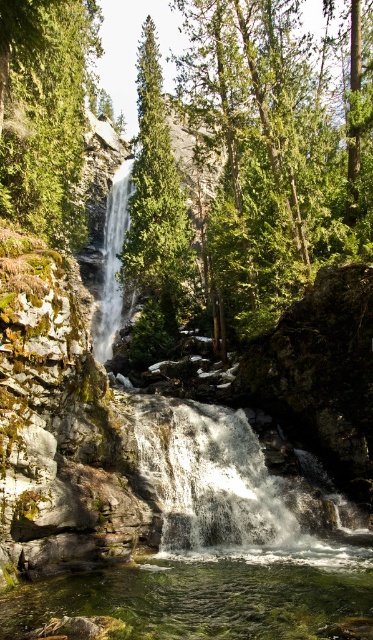
You are a hiker who wants to take a photo of the clear water at center and the green matte tree at upper left from your current position. Can you fit both objects in the frame of your camera which has a maximum field of view of 40 meters?

The distance between clear water at center and green matte tree at upper left is 44.05 meters, which exceeds the camera field of view of 40 meters. Therefore, you cannot fit both objects in the frame.

You are standing at the base of the waterfall and want to take a photo of both the green matte tree at upper left and the green matte tree at center. Which tree should you focus on first to ensure both are in clear view?

You should focus on the green matte tree at upper left first because it is closer to you than the green matte tree at center, so adjusting focus from near to far will help capture both clearly.

You are standing at the edge of the pool below the waterfall. You want to place a small decorative stone exactly at the center of the clear water at center. According to the coordinates provided, where should you place the stone?

The clear water at center is located at point (207, 595), so you should place the small decorative stone at coordinates (207, 595) to position it exactly at the center of the clear water at center.